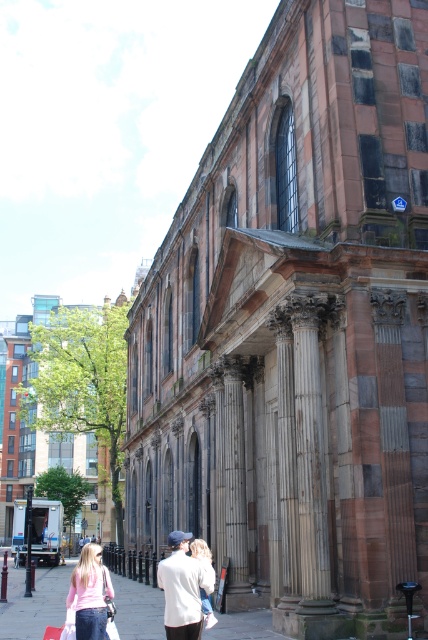
Question: Among these points, which one is farthest from the camera?

Choices:
 (A) (64, 576)
 (B) (32, 554)

Answer: (A)

Question: Is smooth concrete pavement at lower center positioned before matte blue baby carriage at lower left?

Choices:
 (A) no
 (B) yes

Answer: (B)

Question: Estimate the real-world distances between objects in this image. Which object is farther from the matte blue baby carriage at lower left?

Choices:
 (A) white cotton shirt at center
 (B) pink matte shirt at lower left
 (C) light beige sweater at center
 (D) smooth concrete pavement at lower center

Answer: (C)

Question: Is white cotton shirt at center smaller than matte blue baby carriage at lower left?

Choices:
 (A) yes
 (B) no

Answer: (A)

Question: Which object is closer to the camera taking this photo?

Choices:
 (A) pink matte shirt at lower left
 (B) smooth concrete pavement at lower center
 (C) white cotton shirt at center

Answer: (C)

Question: Is white cotton shirt at center to the left of light beige sweater at center from the viewer's perspective?

Choices:
 (A) no
 (B) yes

Answer: (B)